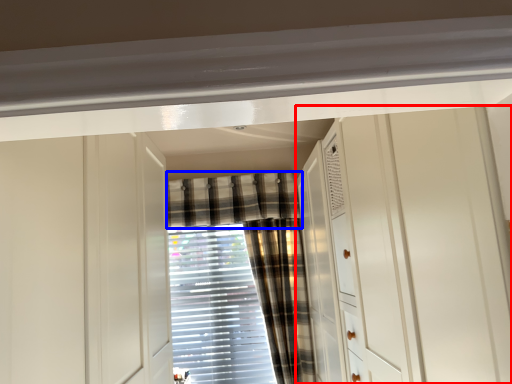
Question: Among these objects, which one is farthest to the camera, dresser (highlighted by a red box) or curtain (highlighted by a blue box)?

Choices:
 (A) dresser
 (B) curtain

Answer: (B)